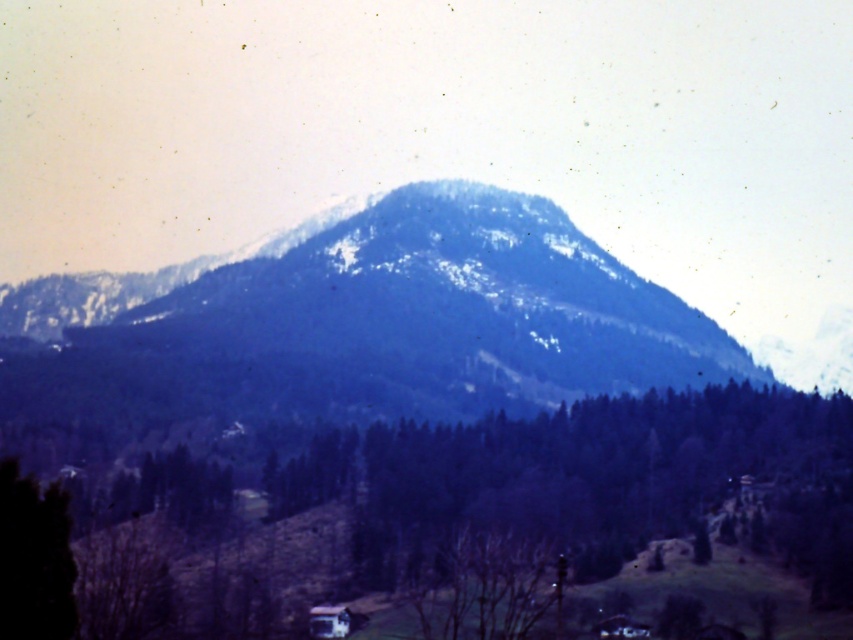
Question: Is green matte tree at center above green matte tree at lower left?

Choices:
 (A) yes
 (B) no

Answer: (B)

Question: Which point is farther from the camera taking this photo?

Choices:
 (A) (633, 349)
 (B) (10, 509)
 (C) (570, 605)

Answer: (A)

Question: Is green matte tree at center wider than snowy forested mountain at center?

Choices:
 (A) no
 (B) yes

Answer: (A)

Question: Which point is farther to the camera?

Choices:
 (A) green matte tree at lower left
 (B) green matte tree at center

Answer: (B)

Question: Which of the following is the farthest from the observer?

Choices:
 (A) green matte tree at center
 (B) green matte tree at lower left

Answer: (A)

Question: Where is snowy forested mountain at center located in relation to green matte tree at lower left in the image?

Choices:
 (A) below
 (B) above

Answer: (B)